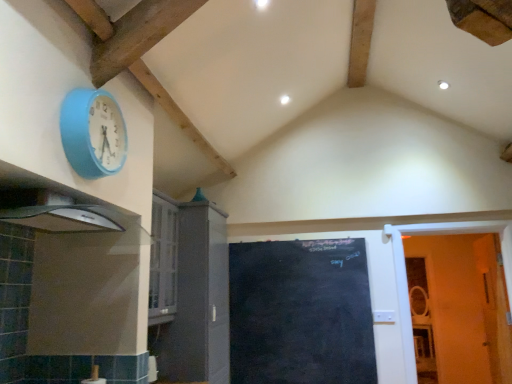
Question: Considering the positions of white wooden door at right, acting as the second door starting from the left, and black chalkboard at center, positioned as the second door in right-to-left order, in the image, is white wooden door at right, acting as the second door starting from the left, wider or thinner than black chalkboard at center, positioned as the second door in right-to-left order,?

Choices:
 (A) wide
 (B) thin

Answer: (A)

Question: Considering the positions of point (482, 223) and point (287, 344), is point (482, 223) closer or farther from the camera than point (287, 344)?

Choices:
 (A) closer
 (B) farther

Answer: (A)

Question: Estimate the real-world distances between objects in this image. Which object is closer to the black chalkboard at center, the 1th door from the left?

Choices:
 (A) white wooden door at right, which is the 1th door from right to left
 (B) blue rubber wall clock at upper left
 (C) matte gray cabinet at center-left

Answer: (C)

Question: Estimate the real-world distances between objects in this image. Which object is closer to the black chalkboard at center, the 1th door from the left?

Choices:
 (A) matte gray cabinet at center-left
 (B) white wooden door at right, which is the 1th door from right to left
 (C) blue rubber wall clock at upper left

Answer: (A)